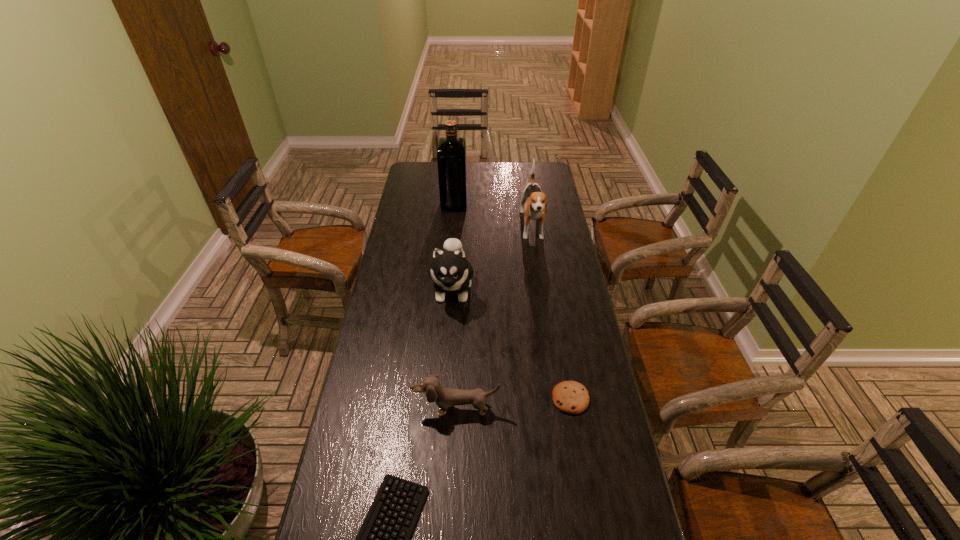
The width and height of the screenshot is (960, 540). I want to click on free space located on the back of the fifth tallest object, so click(559, 332).

Locate an element on the screen. puppy at the right edge is located at coordinates (535, 201).

Image resolution: width=960 pixels, height=540 pixels. What are the coordinates of `cookie that is at the right edge` in the screenshot? It's located at (571, 397).

Find the location of a particular element. Image resolution: width=960 pixels, height=540 pixels. vacant space at the far edge of the desktop is located at coordinates click(479, 166).

The image size is (960, 540). In order to click on vacant space at the left edge of the desktop in this screenshot , I will do `click(353, 488)`.

I want to click on free spot at the right edge of the desktop, so click(x=561, y=362).

Where is `vacant space at the far left corner of the desktop`? vacant space at the far left corner of the desktop is located at coordinates (423, 164).

Where is `vacant region at the far right corner of the desktop`? This screenshot has width=960, height=540. vacant region at the far right corner of the desktop is located at coordinates (543, 164).

Identify the location of free space between the nearest puppy and the rightmost puppy. The height and width of the screenshot is (540, 960). (494, 319).

Locate an element on the screen. This screenshot has height=540, width=960. free point between the farthest puppy and the tallest object is located at coordinates (x=493, y=216).